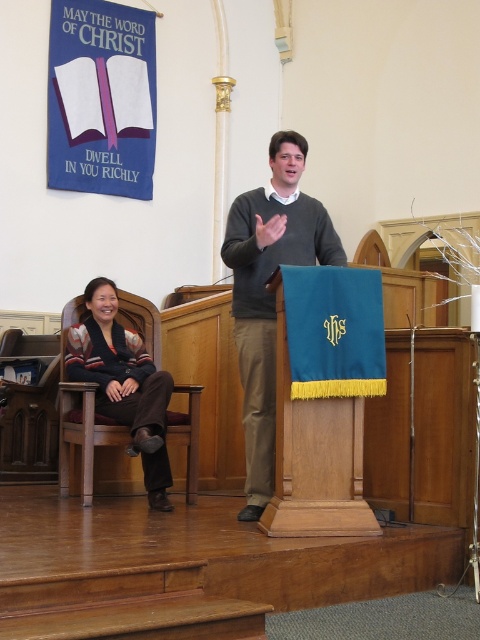
Consider the image. Where is the dark gray sweater at center located in the image?

The dark gray sweater at center is located at point (269, 292).

You are standing in the church and want to place a small flower vase between the two points marked as point [296,177] and point [133,349]. Which point should you place it closer to so that it appears closer to the viewer?

You should place the flower vase closer to point [296,177] because it is closer to the viewer than point [133,349].